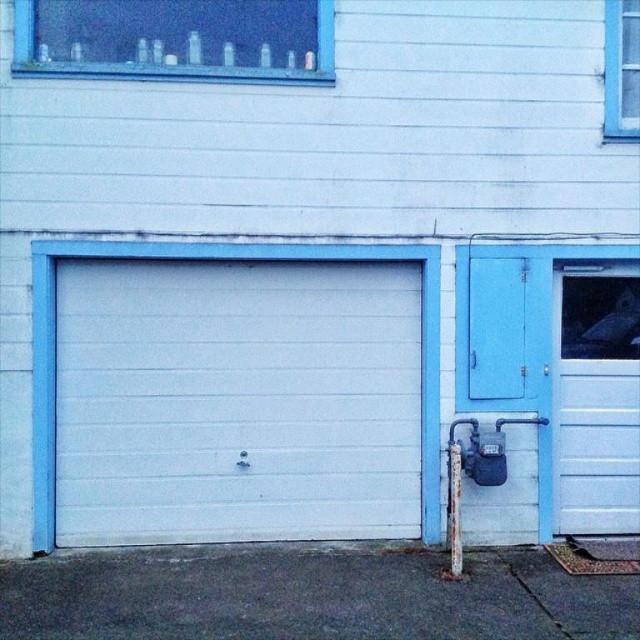
Who is more forward, (595, 346) or (452, 497)?

Point (452, 497)

Is the position of white matte door at right less distant than that of white plastic pole at lower center?

No, it is not.

Who is more forward, (x=564, y=316) or (x=460, y=465)?

Point (x=460, y=465) is more forward.

The image size is (640, 640). I want to click on white matte door at right, so click(595, 397).

Who is shorter, matte blue door at right or transparent glass bottles at upper center?

Standing shorter between the two is transparent glass bottles at upper center.

Locate an element on the screen. matte blue door at right is located at coordinates (557, 371).

This screenshot has height=640, width=640. I want to click on matte blue door at right, so (x=557, y=371).

Can you confirm if white smooth garage door at center is wider than white plastic pole at lower center?

Correct, the width of white smooth garage door at center exceeds that of white plastic pole at lower center.

Which is behind, point (51, 250) or point (451, 476)?

The point (451, 476) is more distant.

Find the location of a particular element. This screenshot has height=640, width=640. white smooth garage door at center is located at coordinates (244, 259).

The image size is (640, 640). Find the location of `white smooth garage door at center`. white smooth garage door at center is located at coordinates (244, 259).